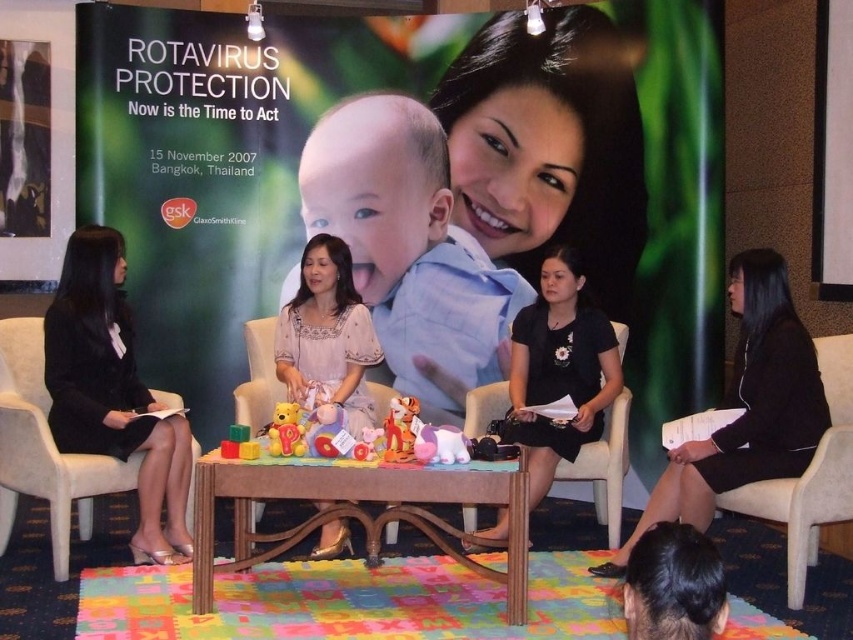
Question: Which object is the closest to the light beige fabric armchair at center?

Choices:
 (A) wooden at center
 (B) soft plush bear at center
 (C) black fabric dress at left
 (D) matte plastic blocks at center

Answer: (C)

Question: Does matte white dress at center have a smaller size compared to beige fabric armchair at right?

Choices:
 (A) yes
 (B) no

Answer: (A)

Question: Which of the following is the farthest from the observer?

Choices:
 (A) green matte poster at upper center
 (B) light beige fabric armchair at center
 (C) wooden at center

Answer: (A)

Question: Considering the relative positions of plush yellow tiger at center and matte plastic blocks at center in the image provided, where is plush yellow tiger at center located with respect to matte plastic blocks at center?

Choices:
 (A) left
 (B) right

Answer: (B)

Question: Is black fabric dress at right above beige fabric armchair at right?

Choices:
 (A) yes
 (B) no

Answer: (A)

Question: Which object appears closest to the camera in this image?

Choices:
 (A) soft plush bear at center
 (B) smooth skin baby at center
 (C) beige fabric armchair at right
 (D) soft plush unicorn at center

Answer: (D)